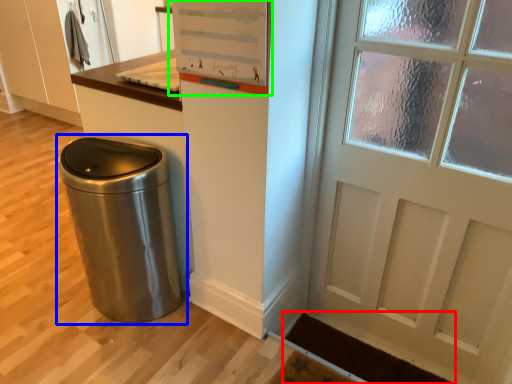
Question: Which object is positioned closest to doormat (highlighted by a red box)? Select from waste container (highlighted by a blue box) and bulletin board (highlighted by a green box).

Choices:
 (A) waste container
 (B) bulletin board

Answer: (A)